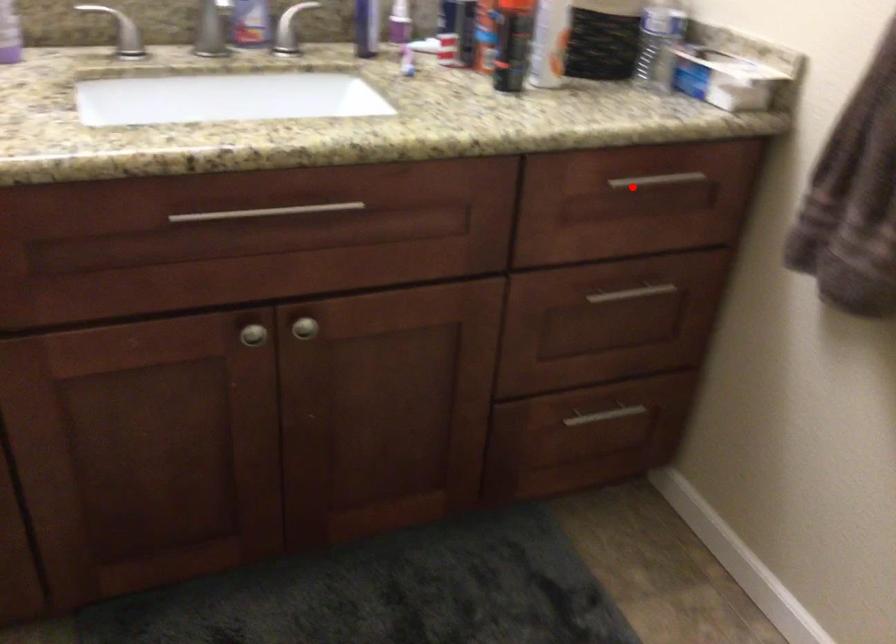
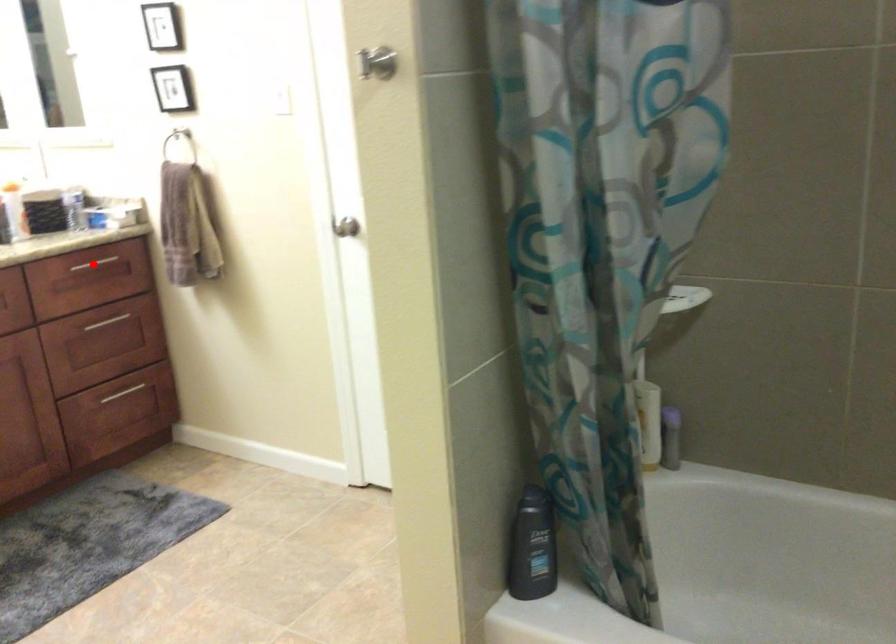
I am providing you with two images of the same scene from different viewpoints. A red point is marked on the first image and another point is marked on the second image. Do the highlighted points in image1 and image2 indicate the same real-world spot?

Yes